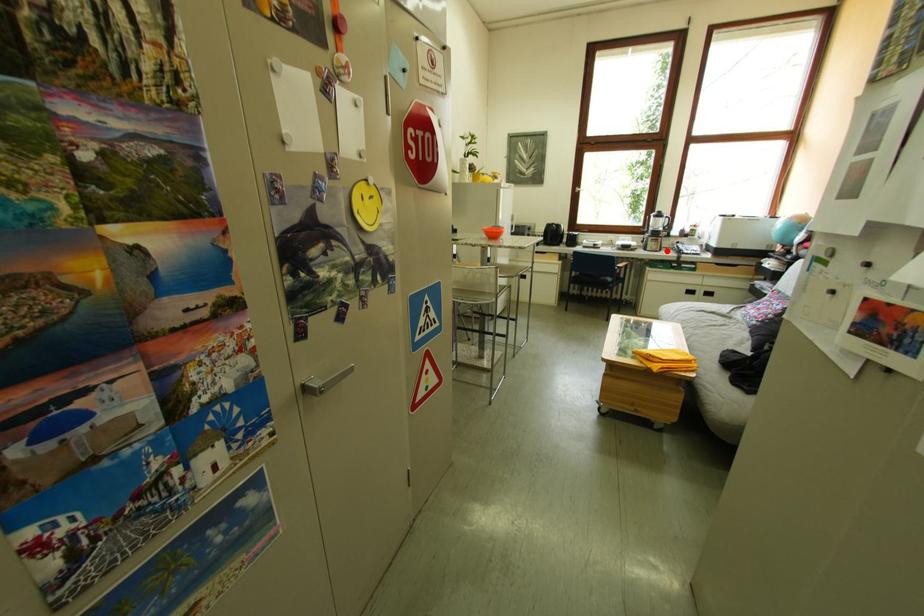
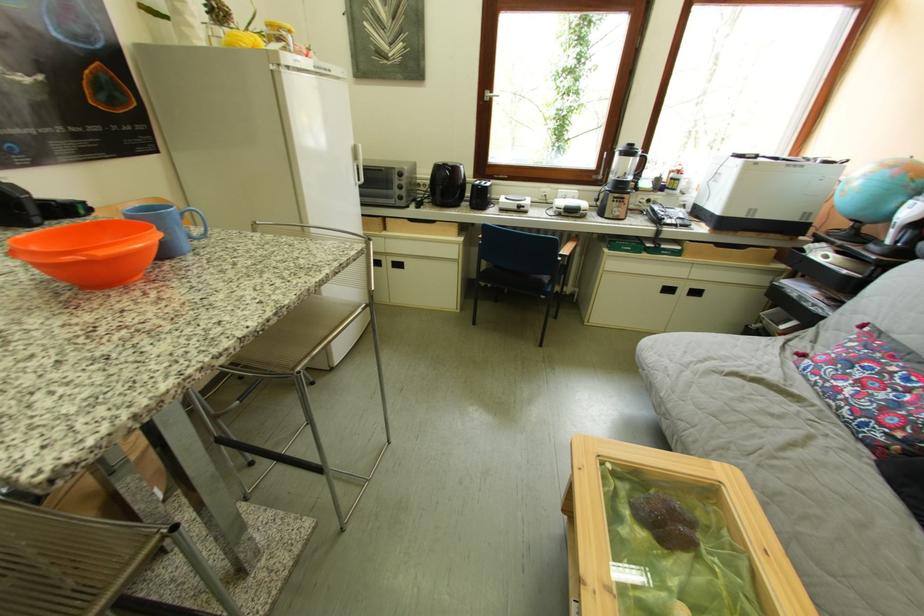
Question: I am providing you with two images of the same scene from different viewpoints. In image1, a red point is highlighted. Considering the same 3D point in image2, which of the following is correct?

Choices:
 (A) It is closer
 (B) It is farther

Answer: (B)